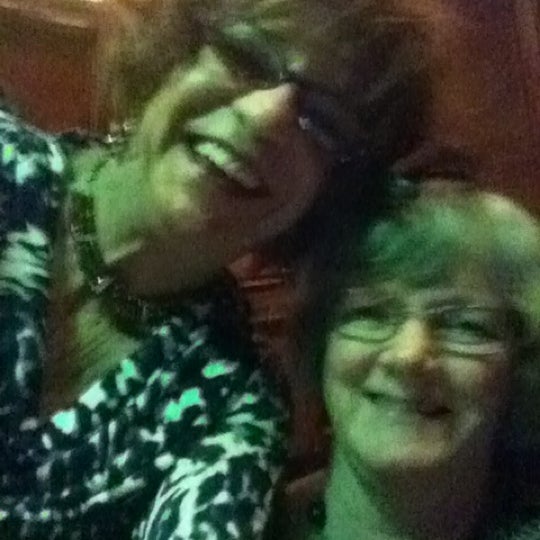
Locate an element on the screen. brown wall is located at coordinates (475, 63).